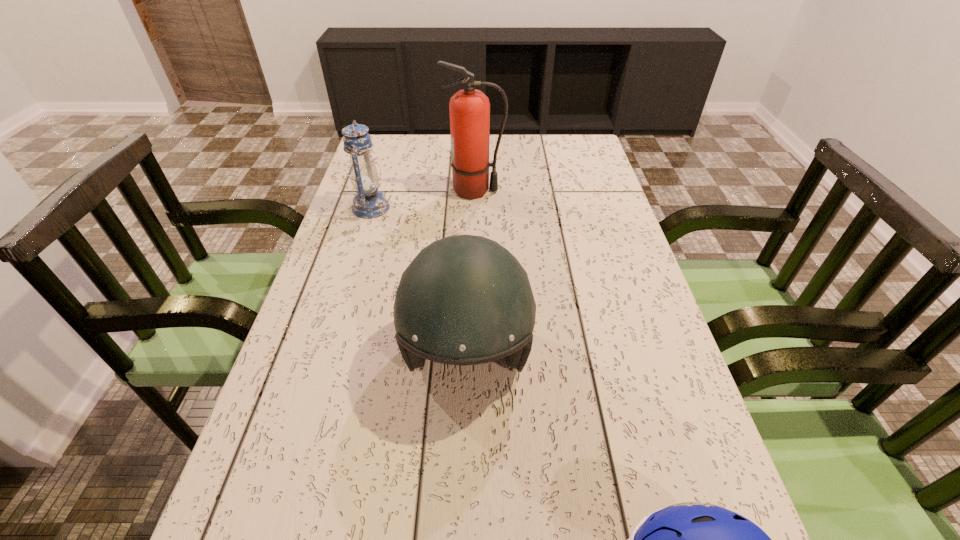
The height and width of the screenshot is (540, 960). Find the location of `vacant region at the right edge`. vacant region at the right edge is located at coordinates (610, 300).

In the image, there is a desktop. At what (x,y) coordinates should I click in order to perform the action: click on vacant region at the far left corner. Please return your answer as a coordinate pair (x, y). The image size is (960, 540). Looking at the image, I should click on (385, 134).

Find the location of `vacant space that is in between the fire extinguisher and the lantern`. vacant space that is in between the fire extinguisher and the lantern is located at coordinates (423, 199).

This screenshot has width=960, height=540. I want to click on vacant area that lies between the lantern and the tallest object, so click(423, 199).

At what (x,y) coordinates should I click in order to perform the action: click on free space between the leftmost object and the tallest object. Please return your answer as a coordinate pair (x, y). Looking at the image, I should click on (423, 199).

Locate an element on the screen. object that stands as the second closest to the shorter football helmet is located at coordinates [469, 109].

Select which object is the second closest to the leftmost object. Please provide its 2D coordinates. Your answer should be formatted as a tuple, i.e. [(x, y)], where the tuple contains the x and y coordinates of a point satisfying the conditions above.

[(464, 300)]

Locate an element on the screen. Image resolution: width=960 pixels, height=540 pixels. free space that satisfies the following two spatial constraints: 1. on the nozzle of the fire extinguisher; 2. at the face opening of the taller football helmet is located at coordinates (472, 356).

The image size is (960, 540). What are the coordinates of `blank space that satisfies the following two spatial constraints: 1. on the nozzle of the tallest object; 2. at the face opening of the taller football helmet` in the screenshot? It's located at (472, 356).